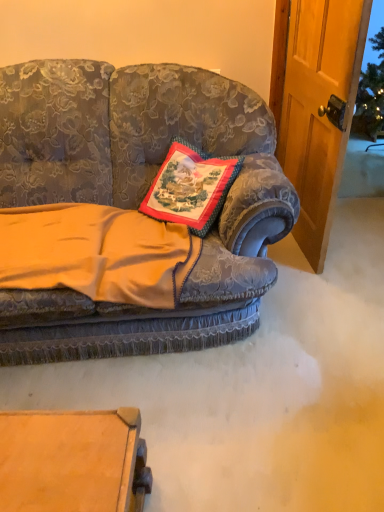
Image resolution: width=384 pixels, height=512 pixels. Describe the element at coordinates (136, 198) in the screenshot. I see `velvet floral couch at center` at that location.

Locate an element on the screen. The width and height of the screenshot is (384, 512). velvet floral couch at center is located at coordinates (136, 198).

What do you see at coordinates (96, 253) in the screenshot? The width and height of the screenshot is (384, 512). I see `velvet gold blanket at center` at bounding box center [96, 253].

Find the location of a particular element. The image size is (384, 512). velvet floral couch at center is located at coordinates (136, 198).

Which of these two, embroidered fabric pillow at center or velvet floral couch at center, is wider?

Wider between the two is velvet floral couch at center.

How much distance is there between embroidered fabric pillow at center and velvet floral couch at center?

embroidered fabric pillow at center is 9.54 inches from velvet floral couch at center.

Does embroidered fabric pillow at center have a larger size compared to velvet floral couch at center?

Actually, embroidered fabric pillow at center might be smaller than velvet floral couch at center.

Is point (197, 185) positioned behind point (155, 106)?

No, it is in front of (155, 106).

How different are the orientations of velvet gold blanket at center and velvet floral couch at center in degrees?

The angular difference between velvet gold blanket at center and velvet floral couch at center is 2.55 degrees.

Who is smaller, velvet gold blanket at center or velvet floral couch at center?

velvet gold blanket at center.

Consider the image. Could you tell me if velvet gold blanket at center is facing velvet floral couch at center?

Yes, velvet gold blanket at center is oriented towards velvet floral couch at center.

Is velvet gold blanket at center positioned far away from velvet floral couch at center?

No, velvet gold blanket at center is not far from velvet floral couch at center.

Does point (221, 195) lie behind point (69, 210)?

No, it is not.

From a real-world perspective, is embroidered fabric pillow at center beneath velvet gold blanket at center?

No.

In terms of height, does embroidered fabric pillow at center look taller or shorter compared to velvet gold blanket at center?

Considering their sizes, embroidered fabric pillow at center has more height than velvet gold blanket at center.

From their relative heights in the image, would you say velvet floral couch at center is taller or shorter than velvet gold blanket at center?

Considering their sizes, velvet floral couch at center has more height than velvet gold blanket at center.

Are velvet floral couch at center and velvet gold blanket at center beside each other?

No, velvet floral couch at center is not next to velvet gold blanket at center.

From a real-world perspective, is velvet floral couch at center physically located above or below velvet gold blanket at center?

From a real-world perspective, velvet floral couch at center is physically above velvet gold blanket at center.

In the scene shown: Is velvet floral couch at center smaller than velvet gold blanket at center?

No, velvet floral couch at center is not smaller than velvet gold blanket at center.

Is velvet gold blanket at center next to embroidered fabric pillow at center and touching it?

There is a gap between velvet gold blanket at center and embroidered fabric pillow at center.

Choose the correct answer: Is velvet gold blanket at center inside embroidered fabric pillow at center or outside it?

velvet gold blanket at center cannot be found inside embroidered fabric pillow at center.

Who is more distant, velvet gold blanket at center or embroidered fabric pillow at center?

Positioned behind is embroidered fabric pillow at center.

Does velvet floral couch at center turn towards embroidered fabric pillow at center?

Yes, velvet floral couch at center faces towards embroidered fabric pillow at center.

Considering the relative sizes of velvet floral couch at center and embroidered fabric pillow at center in the image provided, is velvet floral couch at center thinner than embroidered fabric pillow at center?

Incorrect, the width of velvet floral couch at center is not less than that of embroidered fabric pillow at center.

Locate an element on the screen. pillow above the velvet floral couch at center (from the image's perspective) is located at coordinates point(190,187).

Between velvet floral couch at center and embroidered fabric pillow at center, which one has more height?

Standing taller between the two is velvet floral couch at center.

Image resolution: width=384 pixels, height=512 pixels. Find the location of `studio couch in front of the embroidered fabric pillow at center`. studio couch in front of the embroidered fabric pillow at center is located at coordinates (136, 198).

Where is `blanket below the velvet floral couch at center (from a real-world perspective)`? Image resolution: width=384 pixels, height=512 pixels. blanket below the velvet floral couch at center (from a real-world perspective) is located at coordinates (96, 253).

When comparing their distances from velvet floral couch at center, does velvet gold blanket at center or embroidered fabric pillow at center seem further?

embroidered fabric pillow at center is positioned further to the anchor velvet floral couch at center.

Consider the image. From the image, which object appears to be farther from embroidered fabric pillow at center, velvet gold blanket at center or velvet floral couch at center?

velvet gold blanket at center is positioned further to the anchor embroidered fabric pillow at center.

Which object lies nearer to the anchor point velvet floral couch at center, embroidered fabric pillow at center or velvet gold blanket at center?

velvet gold blanket at center.

Considering their positions, is velvet floral couch at center positioned closer to velvet gold blanket at center than embroidered fabric pillow at center?

The object closer to velvet gold blanket at center is velvet floral couch at center.

Looking at the image, which one is located closer to velvet gold blanket at center, embroidered fabric pillow at center or velvet floral couch at center?

velvet floral couch at center.

Which object lies nearer to the anchor point embroidered fabric pillow at center, velvet floral couch at center or velvet gold blanket at center?

velvet floral couch at center.

Where is `studio couch situated between velvet gold blanket at center and embroidered fabric pillow at center from left to right`? The image size is (384, 512). studio couch situated between velvet gold blanket at center and embroidered fabric pillow at center from left to right is located at coordinates (136, 198).